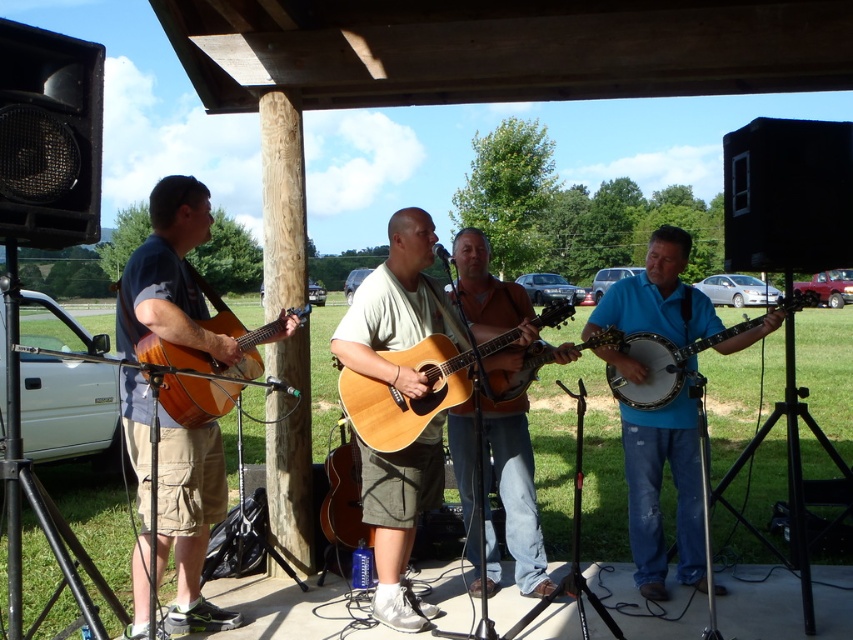
Is matte brown guitar at left shorter than matte brown banjo at right?

Incorrect, matte brown guitar at left's height does not fall short of matte brown banjo at right's.

Is point (202, 598) behind point (811, 300)?

Yes, point (202, 598) is farther from viewer.

Is point (173, 336) positioned behind point (669, 362)?

No, (173, 336) is closer to viewer.

Locate an element on the screen. The image size is (853, 640). matte brown guitar at left is located at coordinates (170, 275).

Consider the image. Is light wood acoustic guitar at center above matte wood guitar at center?

Correct, light wood acoustic guitar at center is located above matte wood guitar at center.

What do you see at coordinates (410, 394) in the screenshot?
I see `light wood acoustic guitar at center` at bounding box center [410, 394].

Who is more forward, (x=558, y=324) or (x=325, y=531)?

Positioned in front is point (x=558, y=324).

This screenshot has width=853, height=640. In order to click on light wood acoustic guitar at center in this screenshot , I will do `click(410, 394)`.

Who is lower down, light brown wood guitar at center or matte wood guitar at center?

matte wood guitar at center

Who is positioned more to the left, light brown wood guitar at center or matte wood guitar at center?

Positioned to the left is matte wood guitar at center.

Describe the element at coordinates (397, 307) in the screenshot. This screenshot has width=853, height=640. I see `light brown wood guitar at center` at that location.

At what (x,y) coordinates should I click in order to perform the action: click on light brown wood guitar at center. Please return your answer as a coordinate pair (x, y). The height and width of the screenshot is (640, 853). Looking at the image, I should click on click(x=397, y=307).